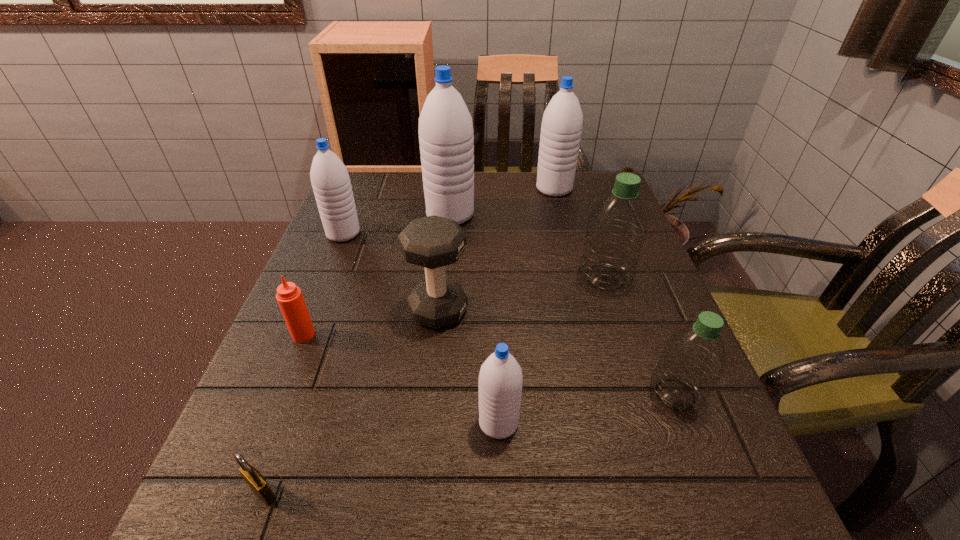
At what (x,y) coordinates should I click in order to perform the action: click on vacant space located on the back of the nearer green water bottle. Please return your answer as a coordinate pair (x, y). Looking at the image, I should click on (638, 301).

This screenshot has height=540, width=960. Identify the location of vacant space located 0.160m on the right of the smallest blue water bottle. (620, 422).

In order to click on free region located on the back of the Tabasco sauce in this screenshot , I will do `click(331, 267)`.

Find the location of `free space located on the back of the brass padlock`. free space located on the back of the brass padlock is located at coordinates (291, 416).

Identify the location of object located at the near edge. (254, 479).

Where is `water bottle present at the left edge`? Image resolution: width=960 pixels, height=540 pixels. water bottle present at the left edge is located at coordinates (331, 184).

Locate an element on the screen. This screenshot has width=960, height=540. Tabasco sauce that is at the left edge is located at coordinates (289, 297).

The height and width of the screenshot is (540, 960). In order to click on padlock at the left edge in this screenshot , I will do `click(254, 479)`.

You are a GUI agent. You are given a task and a screenshot of the screen. Output one action in this format:
    pyautogui.click(x=<x>, y=<y>)
    Task: Click on the object that is positioned at the near left corner
    
    Given the screenshot: What is the action you would take?
    pyautogui.click(x=254, y=479)

This screenshot has height=540, width=960. I want to click on object positioned at the far right corner, so click(562, 122).